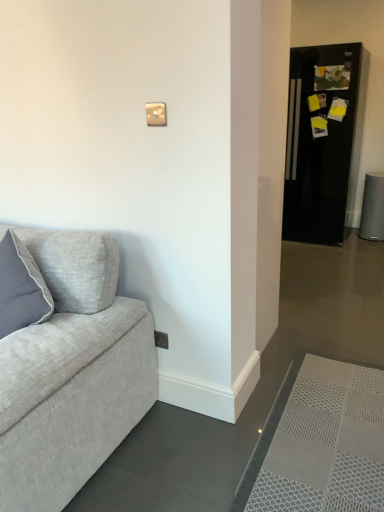
The height and width of the screenshot is (512, 384). What do you see at coordinates (322, 140) in the screenshot? I see `black glossy refrigerator at right` at bounding box center [322, 140].

The width and height of the screenshot is (384, 512). Identify the location of matte white light switch at upper center. (156, 114).

Where is `black glossy refrigerator at right`? black glossy refrigerator at right is located at coordinates (322, 140).

Does black glossy refrigerator at right have a greater width compared to matte white light switch at upper center?

Yes.

Can you confirm if black glossy refrigerator at right is shorter than matte white light switch at upper center?

Incorrect, the height of black glossy refrigerator at right does not fall short of that of matte white light switch at upper center.

Is there a large distance between black glossy refrigerator at right and matte white light switch at upper center?

Indeed, black glossy refrigerator at right is not near matte white light switch at upper center.

Image resolution: width=384 pixels, height=512 pixels. Find the location of `light switch lying on the left of black glossy refrigerator at right`. light switch lying on the left of black glossy refrigerator at right is located at coordinates (156, 114).

In the image, is black glossy refrigerator at right positioned in front of or behind white mesh doormat at lower right?

black glossy refrigerator at right is behind white mesh doormat at lower right.

From the image's perspective, is black glossy refrigerator at right located above or below white mesh doormat at lower right?

From the image's perspective, black glossy refrigerator at right appears above white mesh doormat at lower right.

Looking at the image, does black glossy refrigerator at right seem bigger or smaller compared to white mesh doormat at lower right?

Clearly, black glossy refrigerator at right is larger in size than white mesh doormat at lower right.

Is white mesh doormat at lower right surrounding matte white light switch at upper center?

No, white mesh doormat at lower right does not contain matte white light switch at upper center.

Is white mesh doormat at lower right not close to matte white light switch at upper center?

white mesh doormat at lower right is far away from matte white light switch at upper center.

From the image's perspective, between white mesh doormat at lower right and matte white light switch at upper center, which one is located above?

matte white light switch at upper center is shown above in the image.

How different are the orientations of white mesh doormat at lower right and matte white light switch at upper center in degrees?

They differ by 3.07 degrees in their facing directions.

Can we say matte white light switch at upper center lies outside black glossy refrigerator at right?

matte white light switch at upper center lies outside black glossy refrigerator at right's area.

In terms of height, does matte white light switch at upper center look taller or shorter compared to black glossy refrigerator at right?

Clearly, matte white light switch at upper center is shorter compared to black glossy refrigerator at right.

Is matte white light switch at upper center aimed at black glossy refrigerator at right?

No, matte white light switch at upper center is not aimed at black glossy refrigerator at right.

Based on their positions, is matte white light switch at upper center located to the left or right of black glossy refrigerator at right?

matte white light switch at upper center is to the left of black glossy refrigerator at right.

Does point (359, 420) come behind point (339, 200)?

No, (359, 420) is closer to viewer.

Which of these two, white mesh doormat at lower right or black glossy refrigerator at right, stands taller?

black glossy refrigerator at right.

From the image's perspective, is white mesh doormat at lower right beneath black glossy refrigerator at right?

Indeed, from the image's perspective, white mesh doormat at lower right is shown beneath black glossy refrigerator at right.

The image size is (384, 512). I want to click on doormat that is on the left side of black glossy refrigerator at right, so click(320, 442).

Are matte white light switch at upper center and white mesh doormat at lower right making contact?

matte white light switch at upper center and white mesh doormat at lower right are clearly separated.

From the image's perspective, which is above, matte white light switch at upper center or white mesh doormat at lower right?

matte white light switch at upper center, from the image's perspective.

Considering the sizes of objects matte white light switch at upper center and white mesh doormat at lower right in the image provided, who is bigger, matte white light switch at upper center or white mesh doormat at lower right?

white mesh doormat at lower right.

How many degrees apart are the facing directions of matte white light switch at upper center and white mesh doormat at lower right?

They differ by 3.07 degrees in their facing directions.

This screenshot has height=512, width=384. In order to click on light switch lying below the black glossy refrigerator at right (from the image's perspective) in this screenshot , I will do `click(156, 114)`.

In the image, there is a black glossy refrigerator at right. Where is `doormat below it (from a real-world perspective)`? The image size is (384, 512). doormat below it (from a real-world perspective) is located at coordinates (320, 442).

Which object lies nearer to the anchor point black glossy refrigerator at right, matte white light switch at upper center or white mesh doormat at lower right?

white mesh doormat at lower right lies closer to black glossy refrigerator at right than the other object.

Looking at the image, which one is located further to matte white light switch at upper center, white mesh doormat at lower right or black glossy refrigerator at right?

black glossy refrigerator at right is further to matte white light switch at upper center.

When comparing their distances from white mesh doormat at lower right, does matte white light switch at upper center or black glossy refrigerator at right seem further?

black glossy refrigerator at right.

Considering their positions, is white mesh doormat at lower right positioned closer to black glossy refrigerator at right than matte white light switch at upper center?

Among the two, white mesh doormat at lower right is located nearer to black glossy refrigerator at right.

Looking at the image, which one is located closer to matte white light switch at upper center, black glossy refrigerator at right or white mesh doormat at lower right?

The object closer to matte white light switch at upper center is white mesh doormat at lower right.

Estimate the real-world distances between objects in this image. Which object is closer to white mesh doormat at lower right, black glossy refrigerator at right or matte white light switch at upper center?

matte white light switch at upper center is positioned closer to the anchor white mesh doormat at lower right.

Find the location of a particular element. This screenshot has width=384, height=512. light switch located between white mesh doormat at lower right and black glossy refrigerator at right in the depth direction is located at coordinates (156, 114).